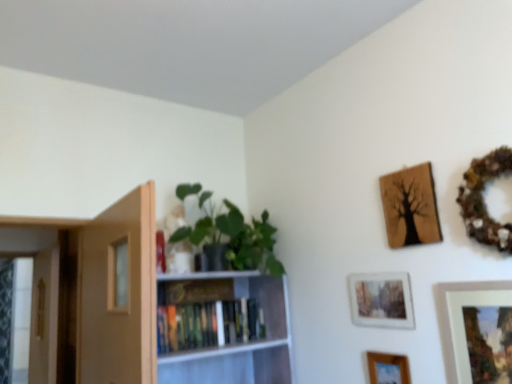
Question: In the image, is green matte plant at upper left on the left side or the right side of wooden textured picture frame at upper right, the 1th picture frame when ordered from top to bottom?

Choices:
 (A) left
 (B) right

Answer: (A)

Question: Is green matte plant at upper left wider or thinner than wooden textured picture frame at upper right, positioned as the fourth picture frame in bottom-to-top order?

Choices:
 (A) wide
 (B) thin

Answer: (A)

Question: Which is farther from the green matte plant at upper left?

Choices:
 (A) wooden picture frame at lower center, which is the first picture frame from bottom to top
 (B) light brown wood door at left
 (C) wooden textured picture frame at upper right, the 1th picture frame when ordered from top to bottom
 (D) matte wooden picture frame at center, the 2th picture frame when ordered from top to bottom
 (E) white glossy bookshelf at center

Answer: (A)

Question: Which object is the closest to the white glossy bookshelf at center?

Choices:
 (A) matte wooden picture frame at center, the third picture frame when ordered from bottom to top
 (B) hardcover books at center
 (C) green matte plant at upper left
 (D) wooden picture frame at lower center, which ranks as the fourth picture frame in top-to-bottom order
 (E) matte white picture frame at lower right, the 2th picture frame ordered from the bottom

Answer: (B)